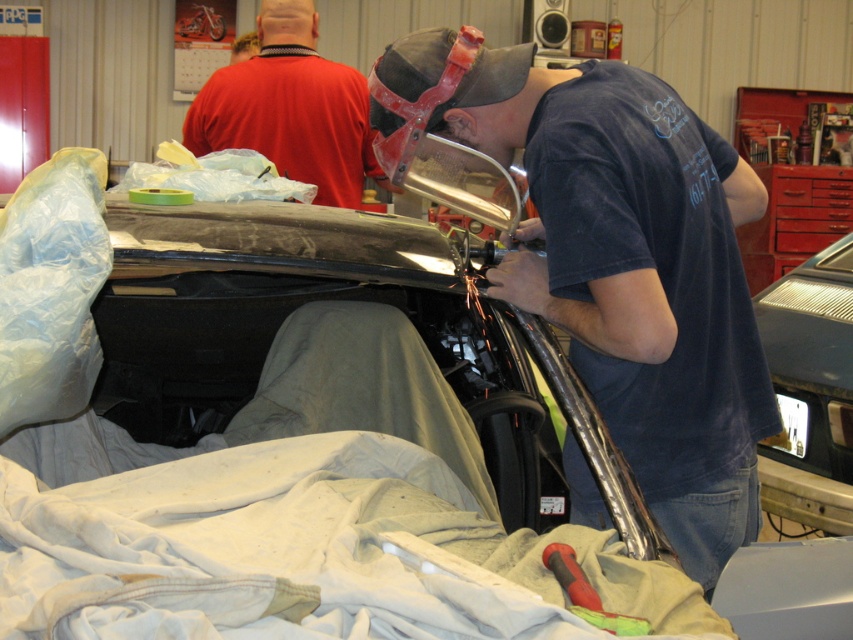
Is point (538, 147) positioned in front of point (830, 524)?

Yes.

How distant is matte black helmet at center from metallic silver car at lower right?

matte black helmet at center and metallic silver car at lower right are 1.90 meters apart.

Which is behind, point (682, 144) or point (791, 460)?

The point (791, 460) is behind.

Identify the location of matte black helmet at center. (619, 262).

Does matte black helmet at center have a smaller size compared to red matte shirt at upper center?

Yes, matte black helmet at center is smaller than red matte shirt at upper center.

In the scene shown: Who is lower down, matte black helmet at center or red matte shirt at upper center?

Positioned lower is matte black helmet at center.

Is point (590, 262) positioned behind point (202, 116)?

No, (590, 262) is in front of (202, 116).

Find the location of `matte black helmet at center`. matte black helmet at center is located at coordinates (619, 262).

Can you confirm if red matte shirt at upper center is shorter than metallic silver car at lower right?

Indeed, red matte shirt at upper center has a lesser height compared to metallic silver car at lower right.

Between red matte shirt at upper center and metallic silver car at lower right, which one has less height?

red matte shirt at upper center is shorter.

Find the location of a particular element. This screenshot has width=853, height=640. red matte shirt at upper center is located at coordinates (291, 108).